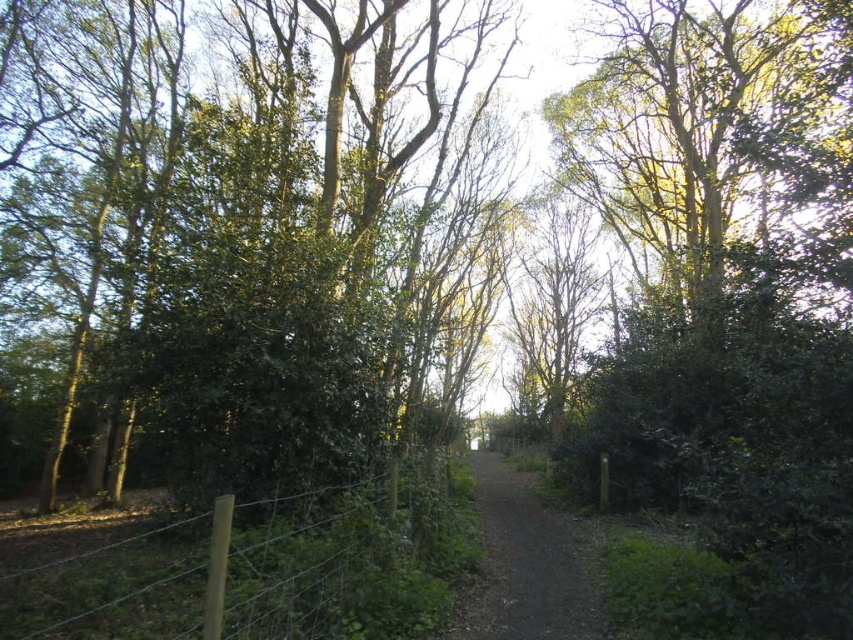
From the picture: Is wooden post at lower left wider than dirt/gravel path at center?

No, wooden post at lower left is not wider than dirt/gravel path at center.

Between wooden post at lower left and dirt/gravel path at center, which one appears on the right side from the viewer's perspective?

dirt/gravel path at center is more to the right.

This screenshot has height=640, width=853. What do you see at coordinates (335, 566) in the screenshot?
I see `wooden post at lower left` at bounding box center [335, 566].

Locate an element on the screen. The height and width of the screenshot is (640, 853). wooden post at lower left is located at coordinates (335, 566).